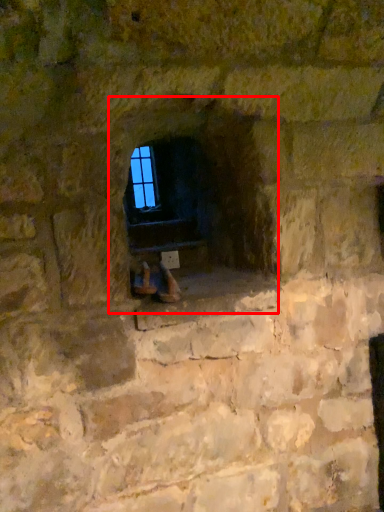
Question: From the image's perspective, what is the correct spatial relationship of fireplace (annotated by the red box) in relation to window?

Choices:
 (A) below
 (B) above

Answer: (A)